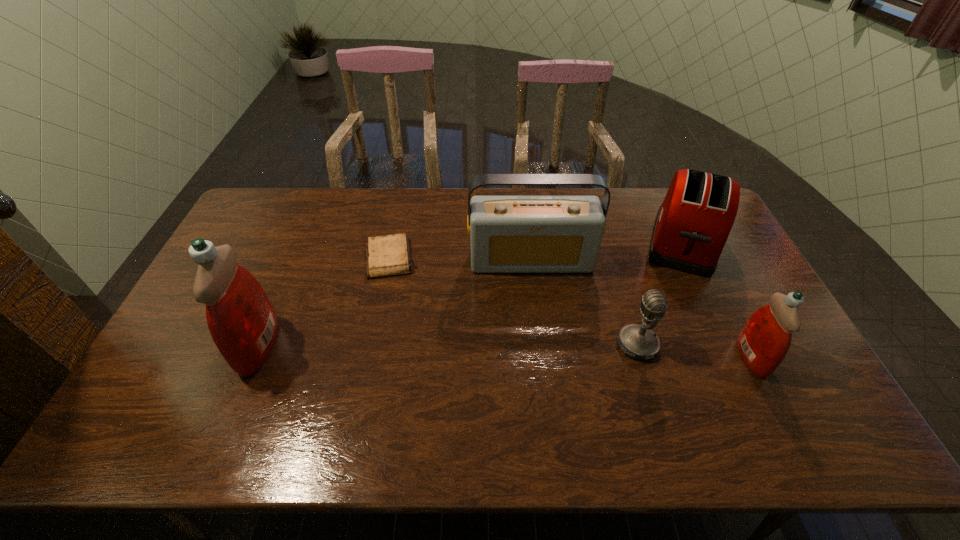
This screenshot has width=960, height=540. I want to click on object at the far edge, so click(x=692, y=225).

This screenshot has height=540, width=960. Identify the location of detergent situated at the right edge. (765, 339).

This screenshot has width=960, height=540. Identify the location of toaster at the right edge. (692, 225).

You are a GUI agent. You are given a task and a screenshot of the screen. Output one action in this format:
    pyautogui.click(x=<x>, y=<y>)
    Task: Click on the object located in the far right corner section of the desktop
    The height and width of the screenshot is (540, 960).
    Given the screenshot: What is the action you would take?
    pyautogui.click(x=692, y=225)

Image resolution: width=960 pixels, height=540 pixels. I want to click on object located at the near right corner, so click(x=765, y=339).

The height and width of the screenshot is (540, 960). In the image, there is a desktop. What are the coordinates of `free space at the far edge` in the screenshot? It's located at (602, 193).

Locate an element on the screen. This screenshot has height=540, width=960. vacant region at the near edge is located at coordinates (245, 400).

In order to click on free region at the left edge of the desktop in this screenshot , I will do `click(202, 310)`.

Where is `free location at the far left corner`? free location at the far left corner is located at coordinates (263, 214).

The width and height of the screenshot is (960, 540). What are the coordinates of `free space between the radio receiver and the diary` in the screenshot? It's located at (461, 259).